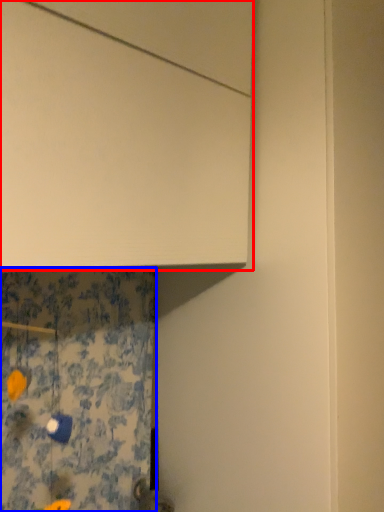
Question: Which of the following is the farthest to the observer, cabinetry (highlighted by a red box) or shower curtain (highlighted by a blue box)?

Choices:
 (A) cabinetry
 (B) shower curtain

Answer: (A)